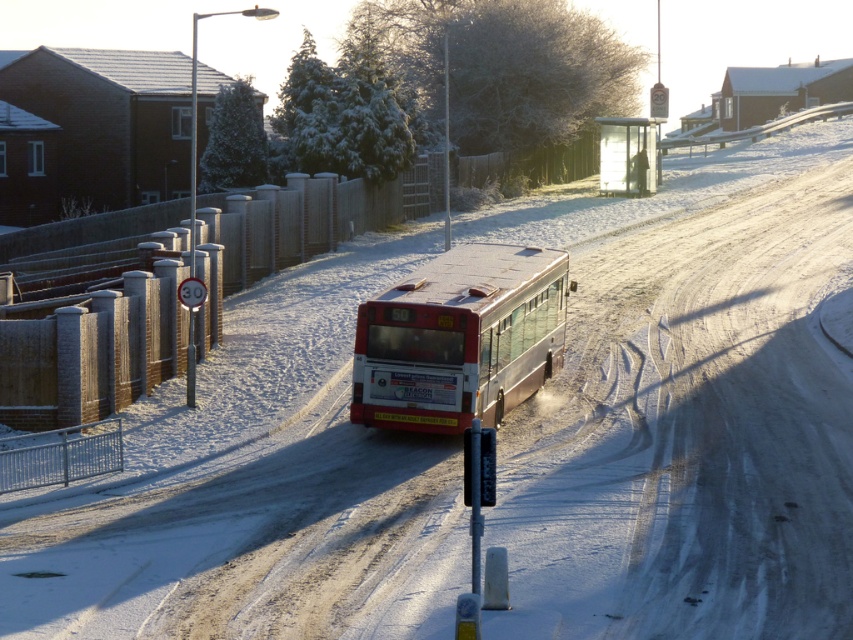
Is silver metallic bus at center thinner than transparent plastic bus stop at center?

Yes.

Where is `silver metallic bus at center`? silver metallic bus at center is located at coordinates (460, 339).

Is point (474, 307) behind point (627, 138)?

No, it is in front of (627, 138).

Identify the location of silver metallic bus at center. (460, 339).